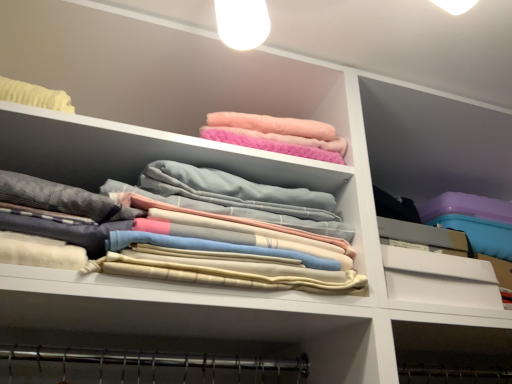
Measure the distance between white matte drawer at right and camera.

They are 31.50 inches apart.

At what (x,y) coordinates should I click in order to perform the action: click on white matte drawer at right. Please return your answer as a coordinate pair (x, y). The image size is (512, 384). Looking at the image, I should click on [439, 279].

The width and height of the screenshot is (512, 384). Describe the element at coordinates (439, 279) in the screenshot. I see `white matte drawer at right` at that location.

The image size is (512, 384). What are the coordinates of `soft pastel fabric at center` in the screenshot? It's located at (191, 243).

The image size is (512, 384). What do you see at coordinates (191, 243) in the screenshot?
I see `soft pastel fabric at center` at bounding box center [191, 243].

I want to click on white matte drawer at right, so [x=439, y=279].

Can you confirm if soft pastel fabric at center is positioned to the right of white matte drawer at right?

Incorrect, soft pastel fabric at center is not on the right side of white matte drawer at right.

Consider the image. Does soft pastel fabric at center come in front of white matte drawer at right?

Yes, soft pastel fabric at center is in front of white matte drawer at right.

Considering the points (184, 271) and (481, 305), which point is in front, point (184, 271) or point (481, 305)?

The point (184, 271) is closer to the camera.

Looking at this image, from the image's perspective, is soft pastel fabric at center located above or below white matte drawer at right?

Based on their image positions, soft pastel fabric at center is located above white matte drawer at right.

From a real-world perspective, is soft pastel fabric at center on top of white matte drawer at right?

Yes, from a real-world perspective, soft pastel fabric at center is over white matte drawer at right

Which of these two, soft pastel fabric at center or white matte drawer at right, is wider?

Wider between the two is soft pastel fabric at center.

Is soft pastel fabric at center taller or shorter than white matte drawer at right?

Clearly, soft pastel fabric at center is taller compared to white matte drawer at right.

Does soft pastel fabric at center have a larger size compared to white matte drawer at right?

Correct, soft pastel fabric at center is larger in size than white matte drawer at right.

Is soft pastel fabric at center inside the boundaries of white matte drawer at right, or outside?

soft pastel fabric at center lies outside white matte drawer at right.

Can you see soft pastel fabric at center touching white matte drawer at right?

No, soft pastel fabric at center is not in contact with white matte drawer at right.

Is soft pastel fabric at center oriented towards white matte drawer at right?

No, soft pastel fabric at center is not aimed at white matte drawer at right.

How different are the orientations of soft pastel fabric at center and white matte drawer at right in degrees?

They differ by 4.33 degrees in their facing directions.

At what (x,y) coordinates should I click in order to perform the action: click on clothing lying on the left of white matte drawer at right. Please return your answer as a coordinate pair (x, y). Looking at the image, I should click on (191, 243).

Does white matte drawer at right appear on the right side of soft pastel fabric at center?

Yes.

Which is in front, white matte drawer at right or soft pastel fabric at center?

soft pastel fabric at center.

Which point is more distant from viewer, (454, 294) or (149, 170)?

Point (454, 294)

From the image's perspective, which object appears higher, white matte drawer at right or soft pastel fabric at center?

From the image's view, soft pastel fabric at center is above.

From a real-world perspective, is white matte drawer at right beneath soft pastel fabric at center?

Yes, from a real-world perspective, white matte drawer at right is below soft pastel fabric at center.

Between white matte drawer at right and soft pastel fabric at center, which one has larger width?

soft pastel fabric at center.

Who is shorter, white matte drawer at right or soft pastel fabric at center?

Standing shorter between the two is white matte drawer at right.

Does white matte drawer at right have a larger size compared to soft pastel fabric at center?

No, white matte drawer at right is not bigger than soft pastel fabric at center.

Is white matte drawer at right situated inside soft pastel fabric at center or outside?

white matte drawer at right exists outside the volume of soft pastel fabric at center.

Is white matte drawer at right with soft pastel fabric at center?

No, white matte drawer at right is not with soft pastel fabric at center.

Is white matte drawer at right looking in the opposite direction of soft pastel fabric at center?

No, soft pastel fabric at center is not at the back of white matte drawer at right.

How different are the orientations of white matte drawer at right and soft pastel fabric at center in degrees?

4.33 degrees separate the facing orientations of white matte drawer at right and soft pastel fabric at center.

How far apart are white matte drawer at right and soft pastel fabric at center?

white matte drawer at right is 30.26 centimeters away from soft pastel fabric at center.

You are a GUI agent. You are given a task and a screenshot of the screen. Output one action in this format:
    pyautogui.click(x=<x>, y=<y>)
    Task: Click on the clothing in front of the white matte drawer at right
    The height and width of the screenshot is (384, 512).
    Given the screenshot: What is the action you would take?
    (x=191, y=243)

Where is `clothing in front of the white matte drawer at right`? clothing in front of the white matte drawer at right is located at coordinates (191, 243).

Identify the location of clothing above the white matte drawer at right (from a real-world perspective). (191, 243).